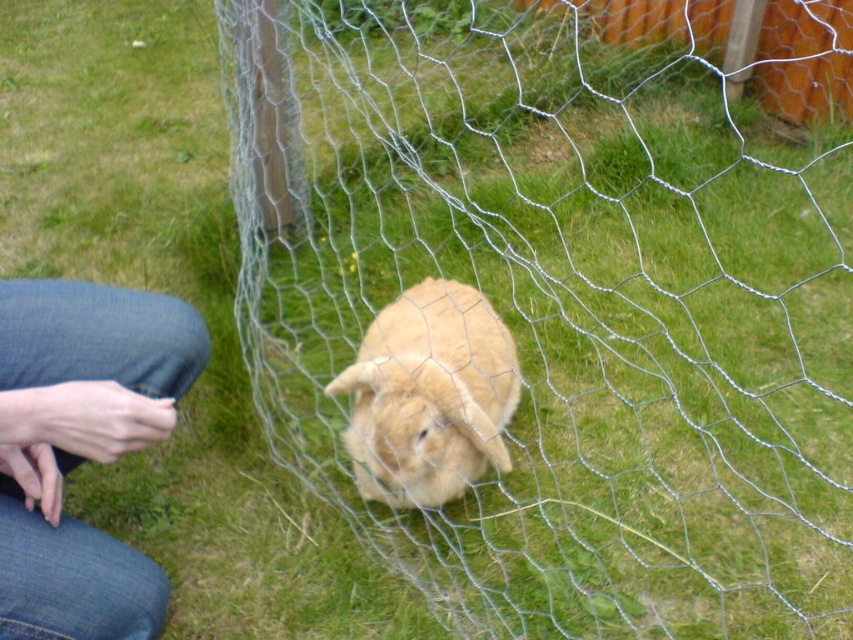
Question: Can you confirm if blue denim jeans at lower left is positioned to the right of fuzzy beige rabbit at center?

Choices:
 (A) no
 (B) yes

Answer: (A)

Question: Which point is farther to the camera?

Choices:
 (A) blue denim jeans at lower left
 (B) wire mesh fence at center

Answer: (B)

Question: Among these objects, which one is nearest to the camera?

Choices:
 (A) blue denim jeans at lower left
 (B) fuzzy beige rabbit at center
 (C) wire mesh fence at center

Answer: (A)

Question: In this image, where is wire mesh fence at center located relative to fuzzy beige rabbit at center?

Choices:
 (A) right
 (B) left

Answer: (A)

Question: Does wire mesh fence at center have a larger size compared to fuzzy beige rabbit at center?

Choices:
 (A) no
 (B) yes

Answer: (B)

Question: Which of the following is the farthest from the observer?

Choices:
 (A) (643, 563)
 (B) (73, 612)

Answer: (A)